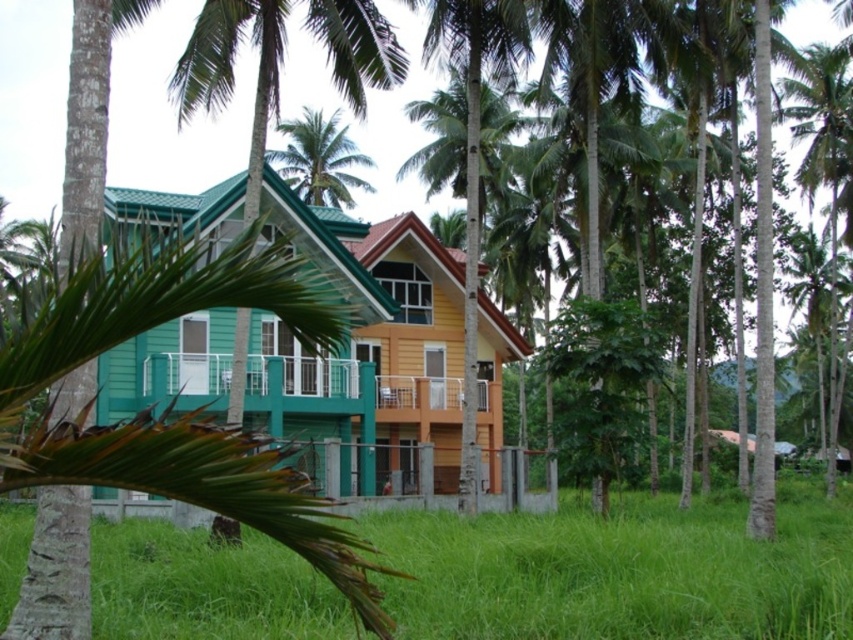
Consider the image. You are standing at the edge of the green grass at lower center and want to reach the green leafy palm tree at center. Which direction should you walk to get closer to the palm tree?

The green grass at lower center is shorter than the green leafy palm tree at center, so you should walk towards the center to get closer to the palm tree.